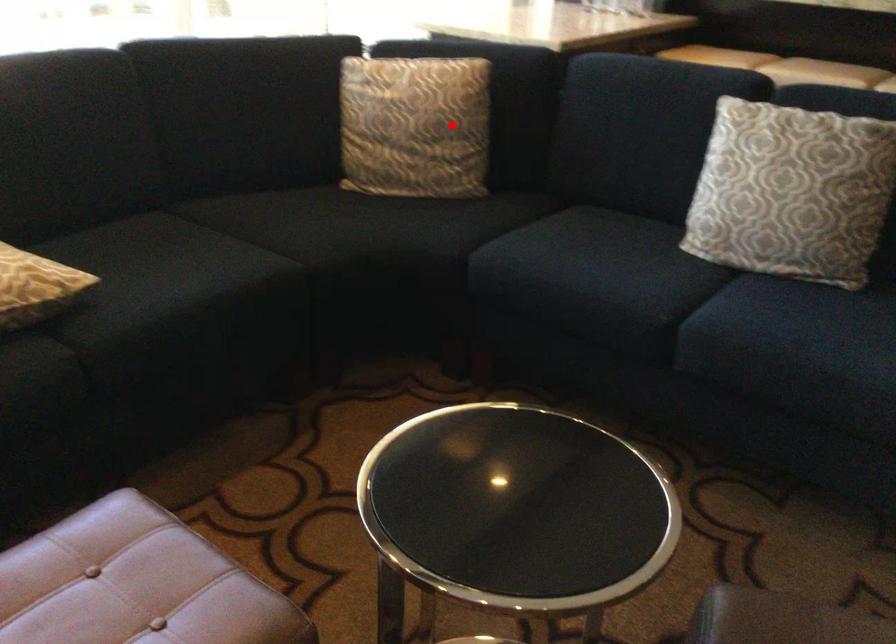
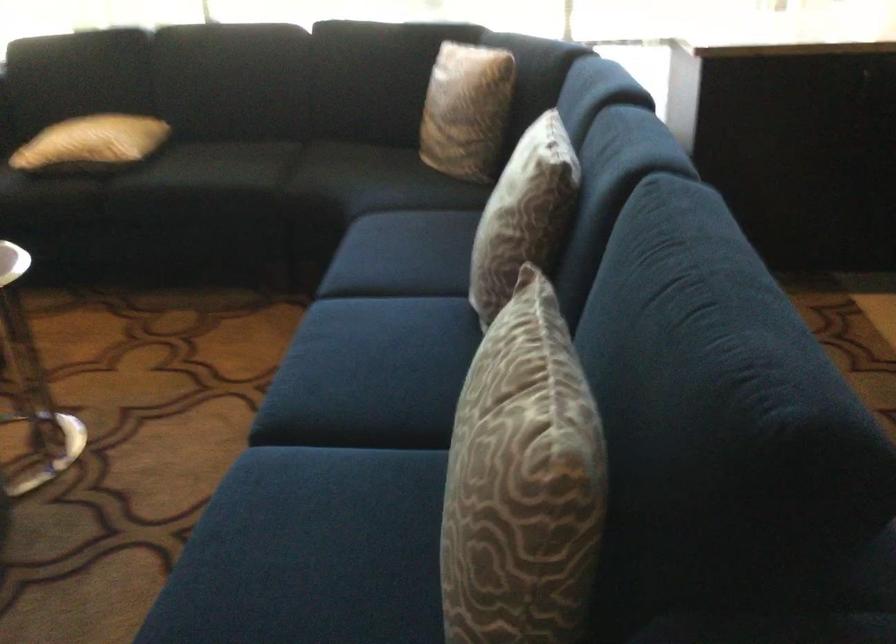
Where in the second image is the point corresponding to the highlighted location from the first image?

(467, 109)